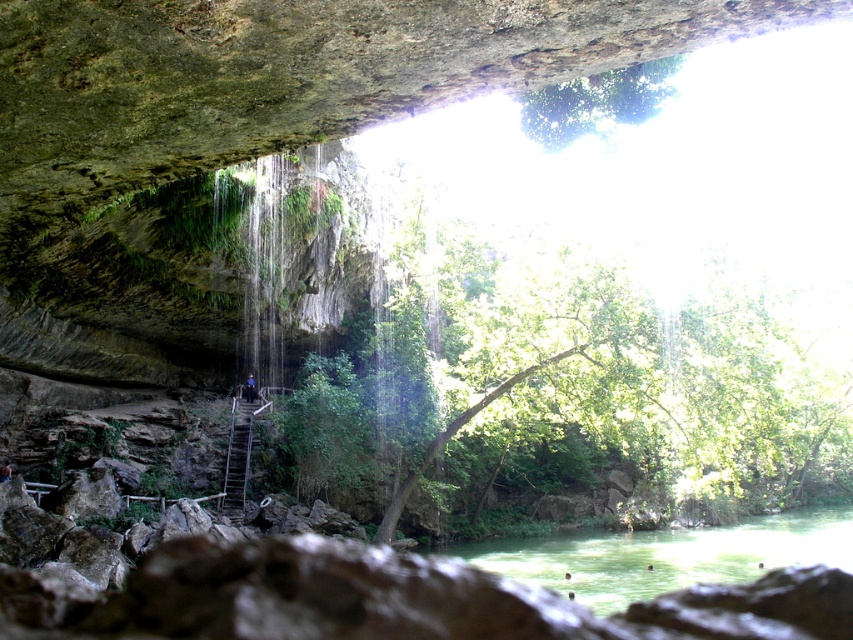
Question: Does green translucent water at lower center have a larger size compared to metallic staircase at center?

Choices:
 (A) yes
 (B) no

Answer: (A)

Question: Is green translucent water at lower center thinner than metallic staircase at center?

Choices:
 (A) no
 (B) yes

Answer: (A)

Question: Is green translucent water at lower center above metallic staircase at center?

Choices:
 (A) yes
 (B) no

Answer: (B)